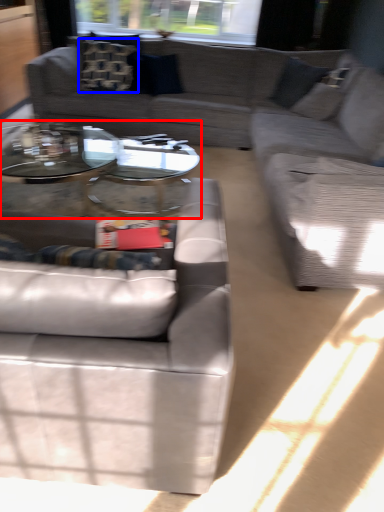
Question: Which object appears farthest to the camera in this image, coffee table (highlighted by a red box) or pillow (highlighted by a blue box)?

Choices:
 (A) coffee table
 (B) pillow

Answer: (B)